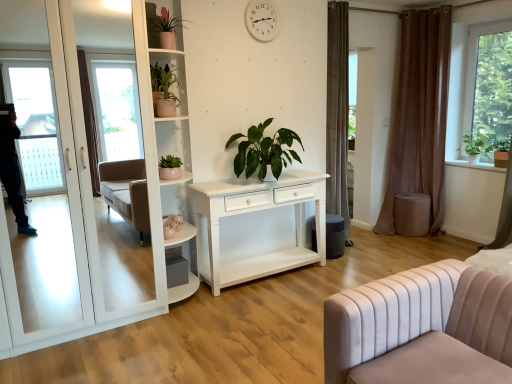
Question: Is green matte plant at upper left, which is the 1th houseplant from left to right, located outside brown velvet curtain at right?

Choices:
 (A) yes
 (B) no

Answer: (A)

Question: Is green matte plant at upper left, which is the 1th houseplant from left to right, touching brown velvet curtain at right?

Choices:
 (A) no
 (B) yes

Answer: (A)

Question: From the image's perspective, is green matte plant at upper left, which is the 1th houseplant from left to right, below brown velvet curtain at right?

Choices:
 (A) yes
 (B) no

Answer: (B)

Question: Is green matte plant at upper left, which is the 1th houseplant from left to right, facing away from brown velvet curtain at right?

Choices:
 (A) yes
 (B) no

Answer: (B)

Question: Considering the relative sizes of green matte plant at upper left, which is the 1th houseplant from left to right, and brown velvet curtain at right in the image provided, is green matte plant at upper left, which is the 1th houseplant from left to right, shorter than brown velvet curtain at right?

Choices:
 (A) yes
 (B) no

Answer: (A)

Question: Considering the positions of velvet beige stool at right and green matte plant at upper left, which is the 1th houseplant from left to right, in the image, is velvet beige stool at right bigger or smaller than green matte plant at upper left, which is the 1th houseplant from left to right,?

Choices:
 (A) big
 (B) small

Answer: (A)

Question: Is velvet beige stool at right to the left or to the right of green matte plant at upper left, positioned as the 4th houseplant in right-to-left order, in the image?

Choices:
 (A) right
 (B) left

Answer: (A)

Question: From the image's perspective, is velvet beige stool at right positioned above or below green matte plant at upper left, positioned as the 4th houseplant in right-to-left order?

Choices:
 (A) below
 (B) above

Answer: (A)

Question: From their relative heights in the image, would you say velvet beige stool at right is taller or shorter than green matte plant at upper left, which is the 1th houseplant from left to right?

Choices:
 (A) short
 (B) tall

Answer: (B)

Question: Relative to velvet beige studio couch at lower right, is white glossy screen door at left in front or behind?

Choices:
 (A) front
 (B) behind

Answer: (B)

Question: Based on their sizes in the image, would you say white glossy screen door at left is bigger or smaller than velvet beige studio couch at lower right?

Choices:
 (A) small
 (B) big

Answer: (B)

Question: Considering the positions of white glossy screen door at left and velvet beige studio couch at lower right in the image, is white glossy screen door at left wider or thinner than velvet beige studio couch at lower right?

Choices:
 (A) wide
 (B) thin

Answer: (B)

Question: Is white glossy screen door at left to the left or to the right of velvet beige studio couch at lower right in the image?

Choices:
 (A) right
 (B) left

Answer: (B)

Question: In terms of width, does white plastic clock at upper center look wider or thinner when compared to green matte plant at upper right?

Choices:
 (A) wide
 (B) thin

Answer: (B)

Question: In the image, is white plastic clock at upper center on the left side or the right side of green matte plant at upper right?

Choices:
 (A) right
 (B) left

Answer: (B)